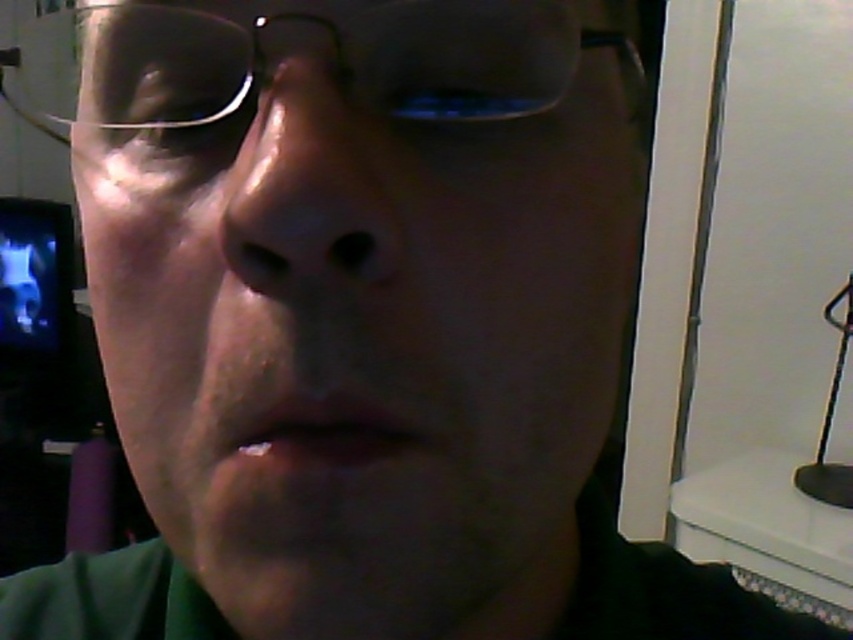
Question: Can you confirm if green matte face at center is positioned above smooth skin nose at center?

Choices:
 (A) yes
 (B) no

Answer: (B)

Question: Which point is closer to the camera?

Choices:
 (A) green matte face at center
 (B) clear plastic glasses at upper center

Answer: (A)

Question: Which point is farther from the camera taking this photo?

Choices:
 (A) (503, 81)
 (B) (596, 138)
 (C) (294, 300)

Answer: (B)

Question: Does green matte face at center appear over clear plastic glasses at upper center?

Choices:
 (A) yes
 (B) no

Answer: (B)

Question: Can you confirm if clear plastic glasses at upper center is thinner than smooth skin nose at center?

Choices:
 (A) no
 (B) yes

Answer: (A)

Question: Which point is closer to the camera?

Choices:
 (A) clear plastic glasses at upper center
 (B) smooth skin nose at center

Answer: (B)